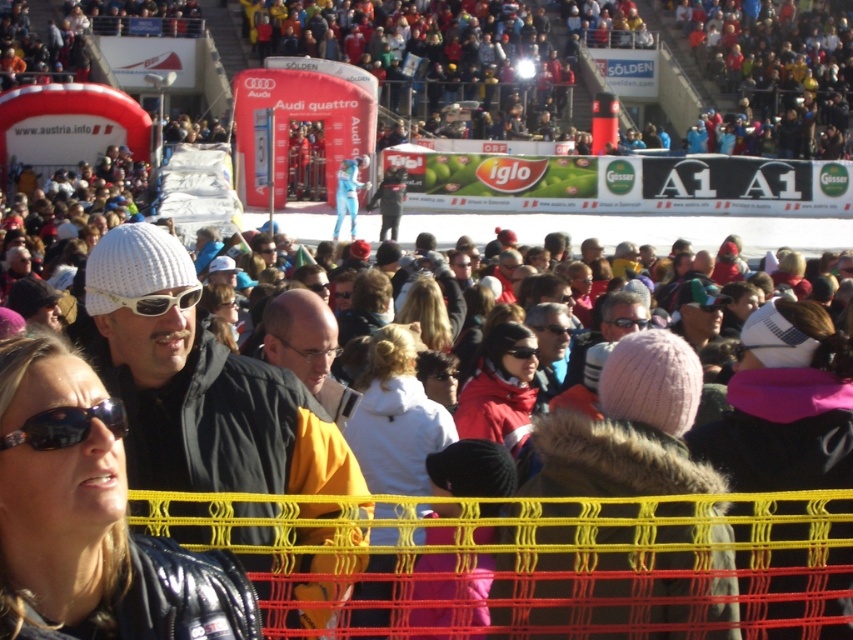
Who is taller, white fleece jacket at center or black matte sunglasses at center?

white fleece jacket at center is taller.

Does white fleece jacket at center have a greater width compared to black matte sunglasses at center?

Yes.

Is point (375, 433) behind point (518, 358)?

No, it is not.

Identify the location of white fleece jacket at center. This screenshot has width=853, height=640. (395, 417).

Is white matte sunglasses at center further to camera compared to black matte goggles at center?

That is False.

The width and height of the screenshot is (853, 640). In order to click on white matte sunglasses at center in this screenshot , I will do `click(154, 300)`.

Is point (189, 291) positioned in front of point (560, 326)?

Yes, it is in front of point (560, 326).

Where is `white matte sunglasses at center`? white matte sunglasses at center is located at coordinates (154, 300).

Is shiny black jacket at center further to the viewer compared to white matte sunglasses at center?

That is False.

Who is more forward, (149, 561) or (120, 305)?

Point (149, 561) is more forward.

The image size is (853, 640). I want to click on shiny black jacket at center, so click(x=91, y=518).